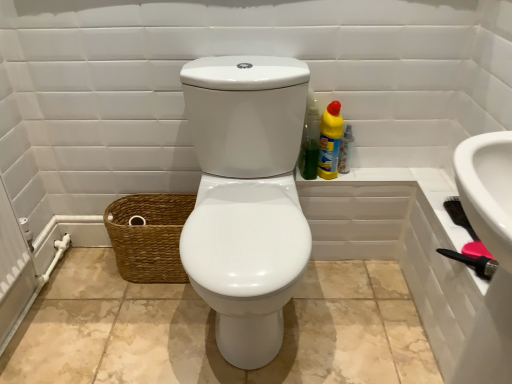
Question: Can you confirm if brown woven basket at lower left is taller than translucent plastic spray bottle at right?

Choices:
 (A) no
 (B) yes

Answer: (B)

Question: From a real-world perspective, does brown woven basket at lower left sit lower than translucent plastic spray bottle at right?

Choices:
 (A) yes
 (B) no

Answer: (A)

Question: Considering the relative sizes of brown woven basket at lower left and translucent plastic spray bottle at right in the image provided, is brown woven basket at lower left shorter than translucent plastic spray bottle at right?

Choices:
 (A) yes
 (B) no

Answer: (B)

Question: From the image's perspective, would you say brown woven basket at lower left is shown under translucent plastic spray bottle at right?

Choices:
 (A) yes
 (B) no

Answer: (A)

Question: Can you confirm if brown woven basket at lower left is positioned to the left of translucent plastic spray bottle at right?

Choices:
 (A) no
 (B) yes

Answer: (B)

Question: Would you say yellow plastic bottle at upper right, which ranks as the first cleaning product in right-to-left order, is to the left or to the right of brown woven basket at lower left in the picture?

Choices:
 (A) left
 (B) right

Answer: (B)

Question: Considering the positions of yellow plastic bottle at upper right, which ranks as the first cleaning product in right-to-left order, and brown woven basket at lower left in the image, is yellow plastic bottle at upper right, which ranks as the first cleaning product in right-to-left order, wider or thinner than brown woven basket at lower left?

Choices:
 (A) thin
 (B) wide

Answer: (A)

Question: Is yellow plastic bottle at upper right, which ranks as the first cleaning product in right-to-left order, situated inside brown woven basket at lower left or outside?

Choices:
 (A) outside
 (B) inside

Answer: (A)

Question: In the image, is yellow plastic bottle at upper right, acting as the second cleaning product starting from the left, positioned in front of or behind brown woven basket at lower left?

Choices:
 (A) front
 (B) behind

Answer: (A)

Question: Do you think brown woven basket at lower left is within yellow plastic bottle at upper right, which ranks as the first cleaning product in right-to-left order, or outside of it?

Choices:
 (A) outside
 (B) inside

Answer: (A)

Question: Considering the positions of brown woven basket at lower left and yellow plastic bottle at upper right, acting as the second cleaning product starting from the left, in the image, is brown woven basket at lower left bigger or smaller than yellow plastic bottle at upper right, acting as the second cleaning product starting from the left,?

Choices:
 (A) small
 (B) big

Answer: (B)

Question: Is brown woven basket at lower left in front of or behind yellow plastic bottle at upper right, which ranks as the first cleaning product in right-to-left order, in the image?

Choices:
 (A) behind
 (B) front

Answer: (A)

Question: From the image's perspective, is brown woven basket at lower left located above or below yellow plastic bottle at upper right, acting as the second cleaning product starting from the left?

Choices:
 (A) above
 (B) below

Answer: (B)

Question: Considering the positions of brown woven basket at lower left and translucent plastic spray bottle at right in the image, is brown woven basket at lower left wider or thinner than translucent plastic spray bottle at right?

Choices:
 (A) thin
 (B) wide

Answer: (B)

Question: Is brown woven basket at lower left taller or shorter than translucent plastic spray bottle at right?

Choices:
 (A) tall
 (B) short

Answer: (A)